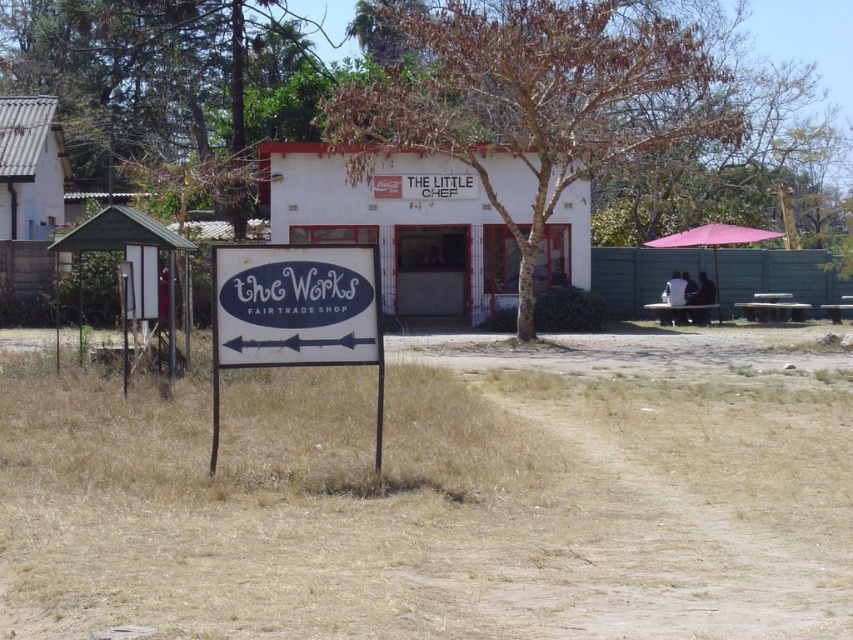
Can you confirm if brown dry grass at center is positioned to the left of pink fabric umbrella at right?

Indeed, brown dry grass at center is positioned on the left side of pink fabric umbrella at right.

Between brown dry grass at center and pink fabric umbrella at right, which one appears on the right side from the viewer's perspective?

Positioned to the right is pink fabric umbrella at right.

This screenshot has width=853, height=640. Identify the location of brown dry grass at center. (438, 496).

How far apart are brown dry grass at center and white plastic sign at center?

brown dry grass at center is 2.66 meters away from white plastic sign at center.

Who is taller, brown dry grass at center or white plastic sign at center?

white plastic sign at center

The width and height of the screenshot is (853, 640). What are the coordinates of `brown dry grass at center` in the screenshot? It's located at (438, 496).

Does white plastic sign at center have a greater height compared to pink fabric umbrella at right?

No.

Which is more to the left, white plastic sign at center or pink fabric umbrella at right?

From the viewer's perspective, white plastic sign at center appears more on the left side.

Image resolution: width=853 pixels, height=640 pixels. I want to click on white plastic sign at center, so pos(294,312).

Locate an element on the screen. The image size is (853, 640). white plastic sign at center is located at coordinates [x=294, y=312].